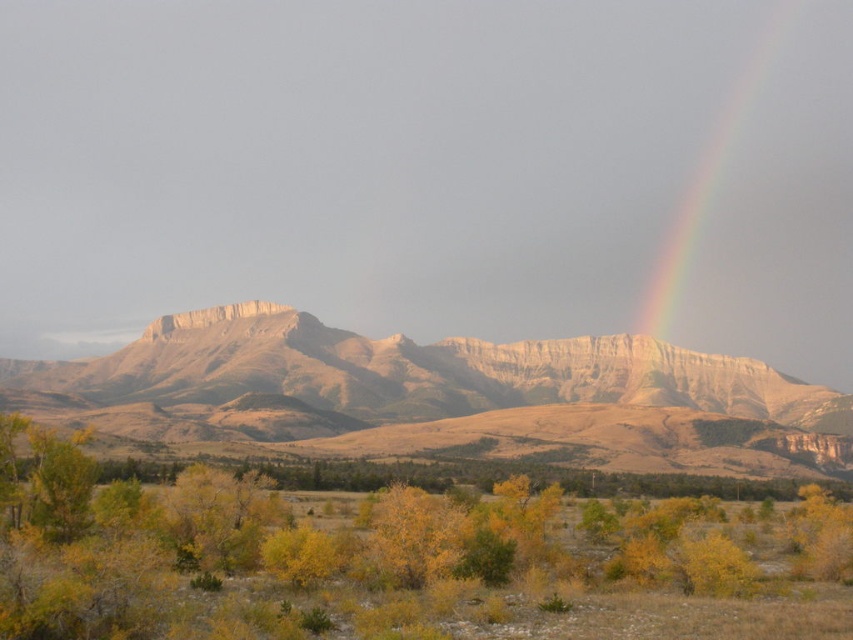
Question: Which point appears farthest from the camera in this image?

Choices:
 (A) (370, 636)
 (B) (741, 67)

Answer: (B)

Question: Where is yellow leafy shrub at lower center located in relation to rainbow at upper right in the image?

Choices:
 (A) left
 (B) right

Answer: (A)

Question: Does rugged sandstone mountain range at center appear on the left side of rainbow at upper right?

Choices:
 (A) yes
 (B) no

Answer: (A)

Question: Is yellow leafy shrub at lower center to the right of rugged sandstone mountain range at center from the viewer's perspective?

Choices:
 (A) no
 (B) yes

Answer: (B)

Question: Estimate the real-world distances between objects in this image. Which object is farther from the yellow leafy shrub at lower center?

Choices:
 (A) rugged sandstone mountain range at center
 (B) rainbow at upper right

Answer: (B)

Question: Which of the following is the farthest from the observer?

Choices:
 (A) (692, 236)
 (B) (555, 529)
 (C) (285, 384)

Answer: (A)